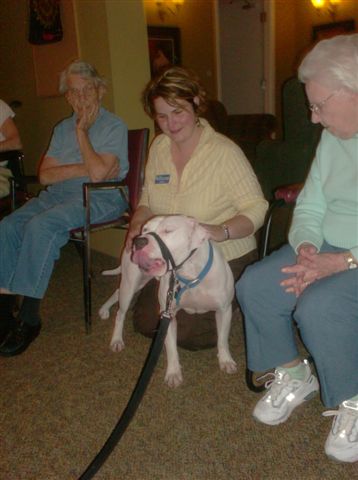
In order to click on white door in this screenshot , I will do `click(245, 77)`.